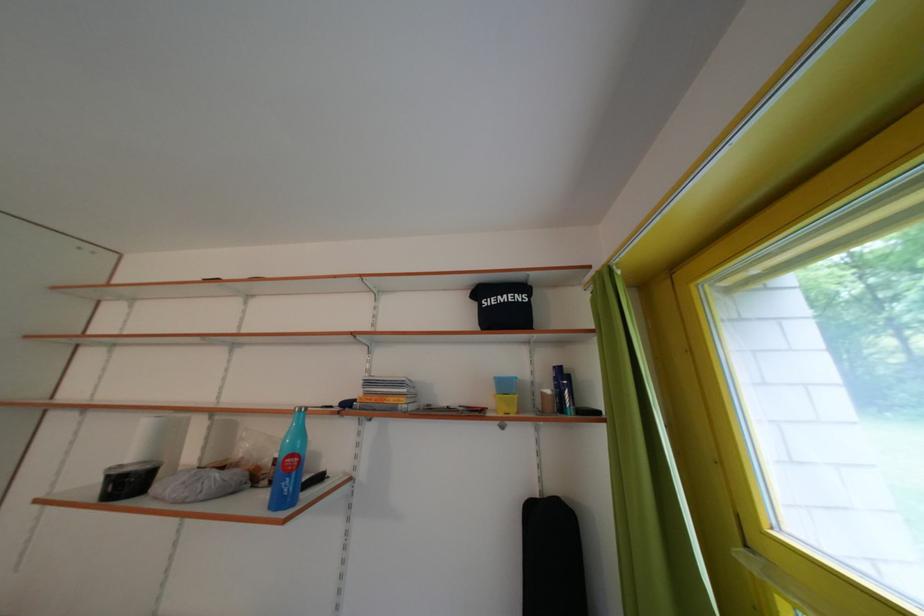
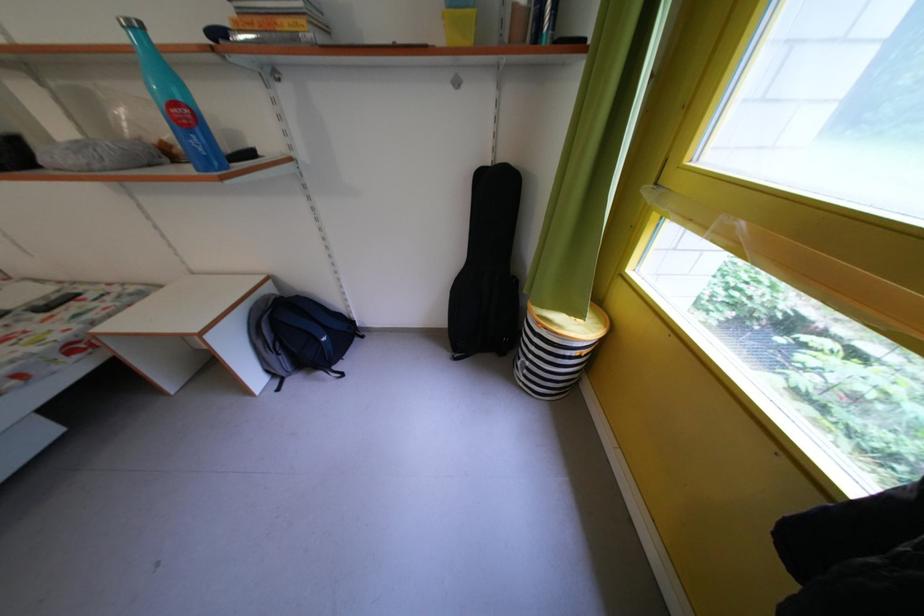
In the second image, find the point that corresponds to [301,461] in the first image.

(185, 110)